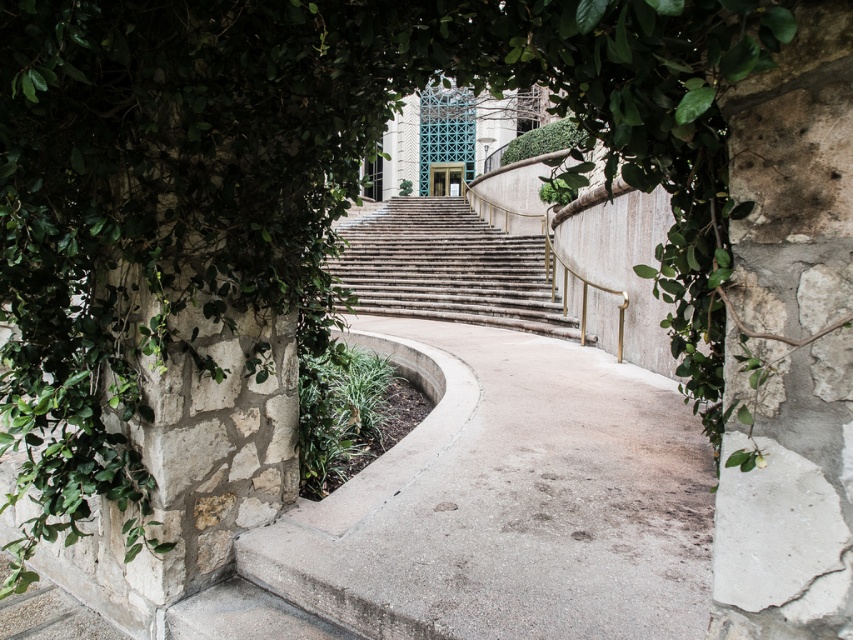
You are standing at the entrance of the building and want to walk down to the gray concrete path at lower center. Which direction should you go?

You should go down towards the gray concrete path at lower center since it is located at point [509,502], which is lower in the image.

You are standing at the entrance of the building and want to walk down to the parking lot. The parking lot is located beyond the gray concrete path at lower center. Which direction should you turn to follow the stone textured stairs at center towards the parking lot?

The gray concrete path at lower center is in front of the stone textured stairs at center, so to reach the parking lot beyond the gray concrete path at lower center, you should go forward past the stone textured stairs at center.

You are standing at the entrance of the building and want to walk down to the parking lot. Which object should you step onto first, the gray concrete path at lower center or the stone textured stairs at center?

You should step onto the gray concrete path at lower center first because it is located below the stone textured stairs at center, meaning the stairs are above and the path is the lower level leading down.